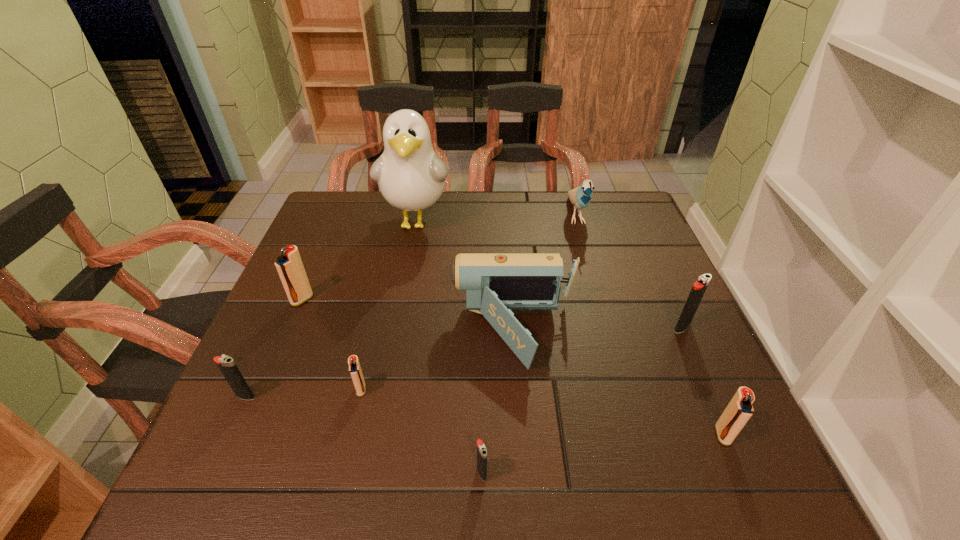
Find the location of a particular element. The image size is (960, 540). white gull is located at coordinates (411, 177).

This screenshot has height=540, width=960. Find the location of `the tallest object`. the tallest object is located at coordinates (411, 177).

In order to click on blue bird in this screenshot , I will do (x=581, y=196).

Where is `bird`? bird is located at coordinates (581, 196).

Where is `camcorder`? This screenshot has height=540, width=960. camcorder is located at coordinates (495, 284).

Find the location of a particular element. This screenshot has width=960, height=540. the biggest red igniter is located at coordinates (290, 268).

Where is `the leftmost red igniter`? The width and height of the screenshot is (960, 540). the leftmost red igniter is located at coordinates [x=290, y=268].

What are the coordinates of `the rightmost black igniter` in the screenshot? It's located at (699, 287).

Image resolution: width=960 pixels, height=540 pixels. I want to click on the biggest black igniter, so click(699, 287).

Identify the location of the second smallest black igniter. (226, 364).